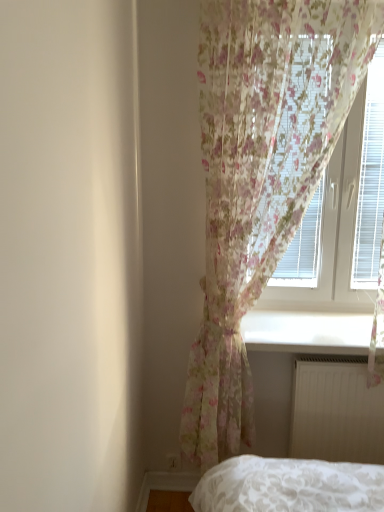
Question: From the image's perspective, is white smooth window sill at lower center on white matte radiator at lower right?

Choices:
 (A) yes
 (B) no

Answer: (A)

Question: Considering the relative positions of white smooth window sill at lower center and white matte radiator at lower right in the image provided, is white smooth window sill at lower center to the left of white matte radiator at lower right from the viewer's perspective?

Choices:
 (A) yes
 (B) no

Answer: (A)

Question: Can you confirm if white smooth window sill at lower center is positioned to the right of white matte radiator at lower right?

Choices:
 (A) no
 (B) yes

Answer: (A)

Question: From a real-world perspective, is white smooth window sill at lower center on white matte radiator at lower right?

Choices:
 (A) no
 (B) yes

Answer: (B)

Question: Can you confirm if white smooth window sill at lower center is smaller than white matte radiator at lower right?

Choices:
 (A) yes
 (B) no

Answer: (B)

Question: Considering their positions, is white matte radiator at lower right located in front of or behind translucent floral curtain at upper right?

Choices:
 (A) front
 (B) behind

Answer: (A)

Question: From a real-world perspective, is white matte radiator at lower right positioned above or below translucent floral curtain at upper right?

Choices:
 (A) below
 (B) above

Answer: (A)

Question: In terms of height, does white matte radiator at lower right look taller or shorter compared to translucent floral curtain at upper right?

Choices:
 (A) short
 (B) tall

Answer: (A)

Question: In terms of size, does white matte radiator at lower right appear bigger or smaller than translucent floral curtain at upper right?

Choices:
 (A) big
 (B) small

Answer: (B)

Question: Is translucent floral curtain at upper right bigger or smaller than white smooth window sill at lower center?

Choices:
 (A) small
 (B) big

Answer: (B)

Question: Relative to white smooth window sill at lower center, is translucent floral curtain at upper right in front or behind?

Choices:
 (A) behind
 (B) front

Answer: (A)

Question: Which is correct: translucent floral curtain at upper right is inside white smooth window sill at lower center, or outside of it?

Choices:
 (A) outside
 (B) inside

Answer: (A)

Question: Is point (324, 309) positioned closer to the camera than point (274, 330)?

Choices:
 (A) closer
 (B) farther

Answer: (B)

Question: Looking at their shapes, would you say white smooth window sill at lower center is wider or thinner than white matte radiator at lower right?

Choices:
 (A) wide
 (B) thin

Answer: (A)

Question: From a real-world perspective, is white smooth window sill at lower center positioned above or below white matte radiator at lower right?

Choices:
 (A) above
 (B) below

Answer: (A)